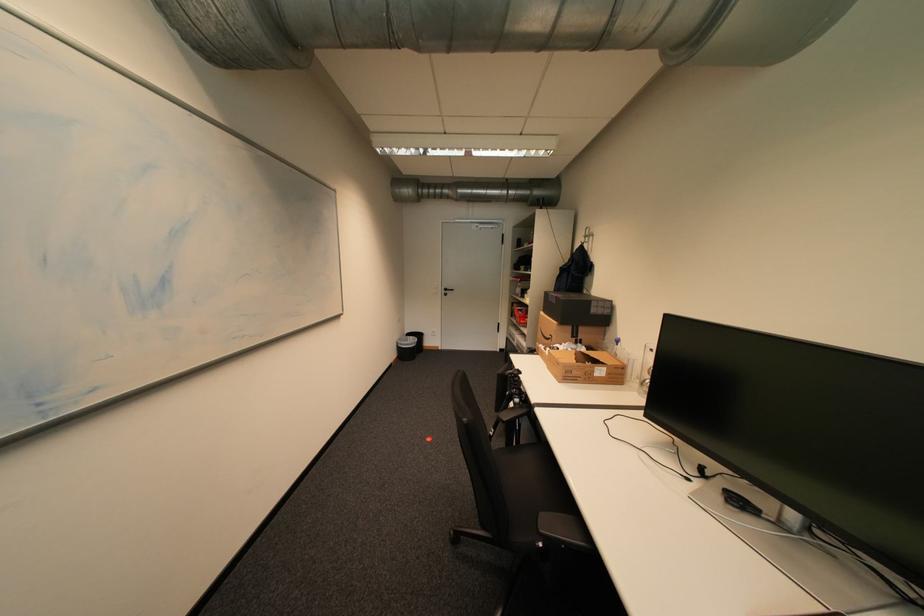
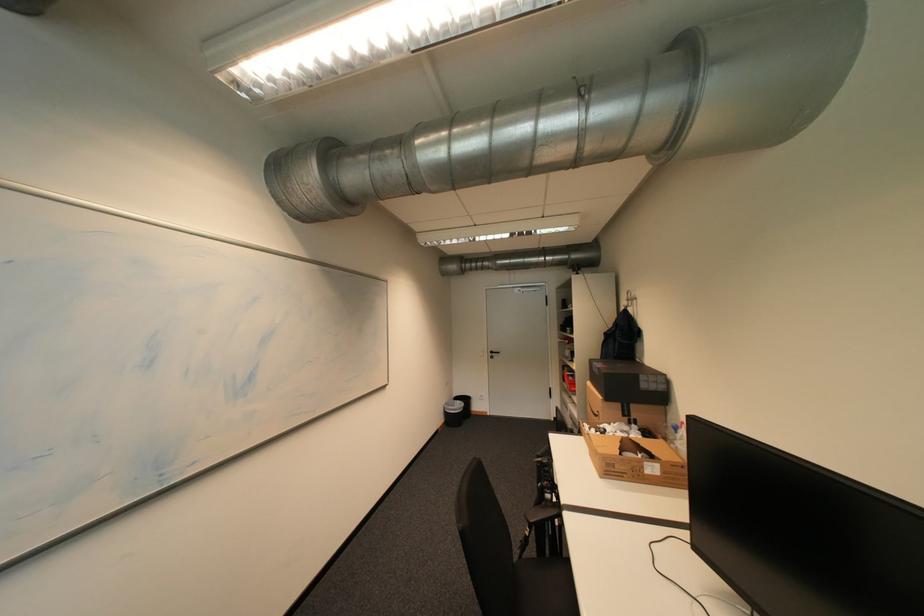
Question: The camera is either moving clockwise (left) or counter-clockwise (right) around the object. The first image is from the beginning of the video and the second image is from the end. Is the camera moving left or right when shooting the video?

Choices:
 (A) Left
 (B) Right

Answer: (B)